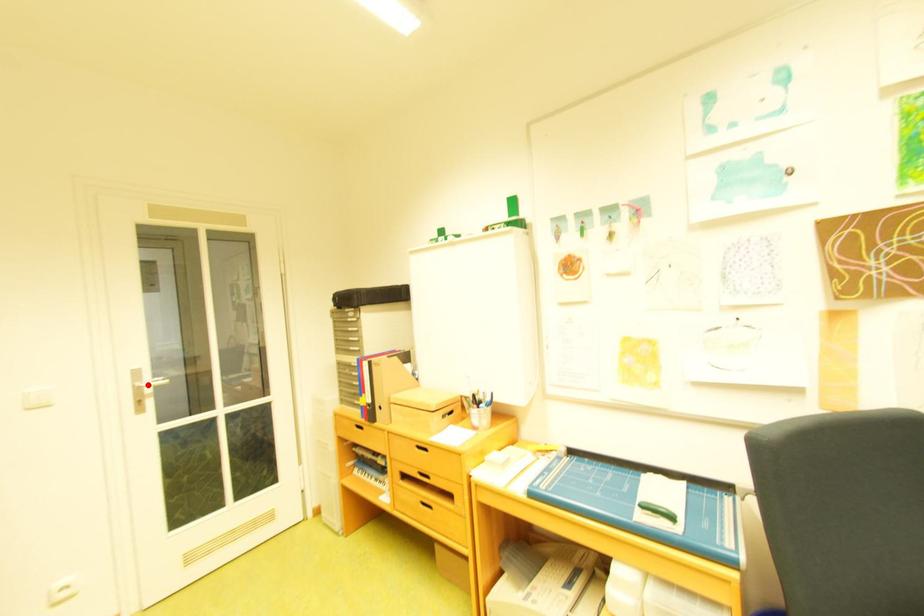
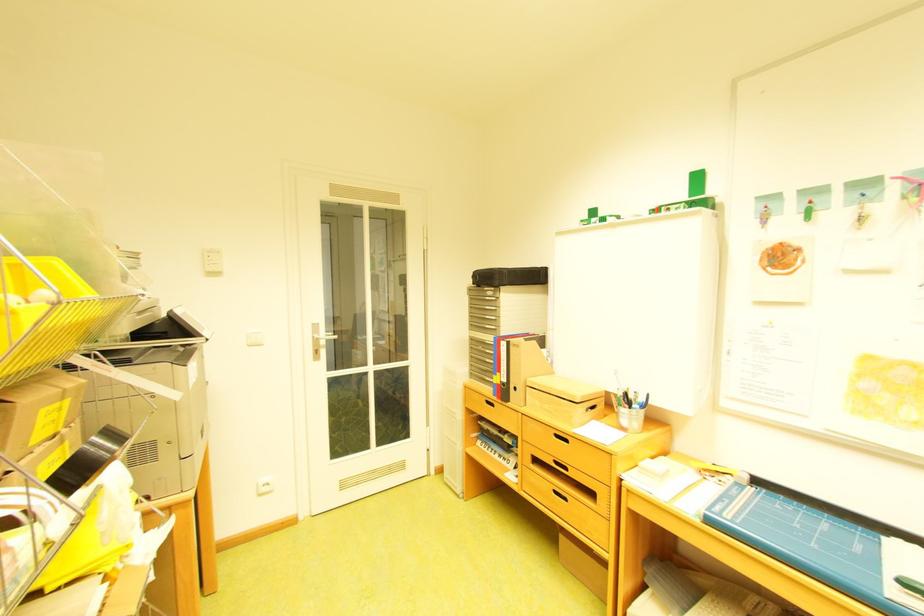
Question: I am providing you with two images of the same scene from different viewpoints. In image1, a red point is highlighted. Considering the same 3D point in image2, which of the following is correct?

Choices:
 (A) It is closer
 (B) It is farther

Answer: (A)